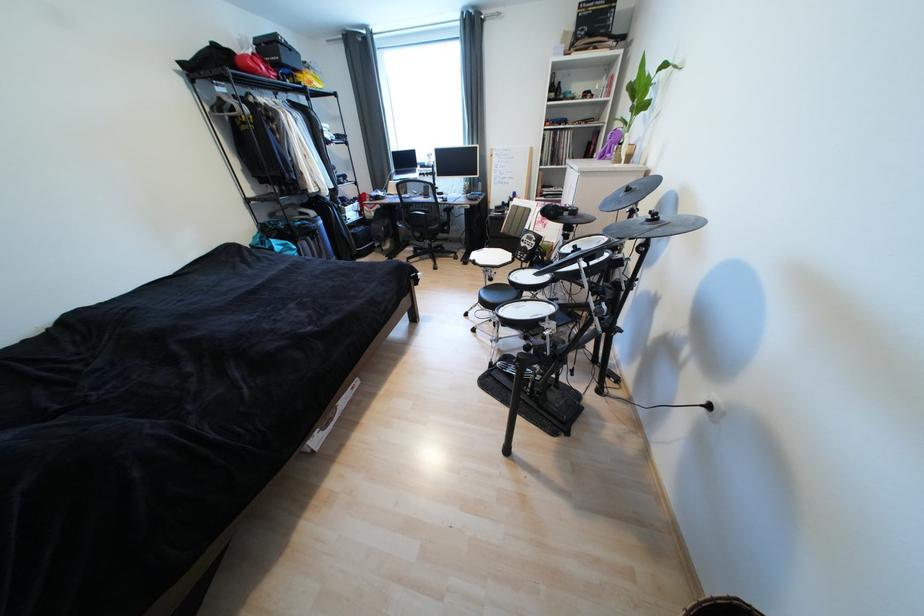
Find the location of `white power outlet`. white power outlet is located at coordinates (714, 408).